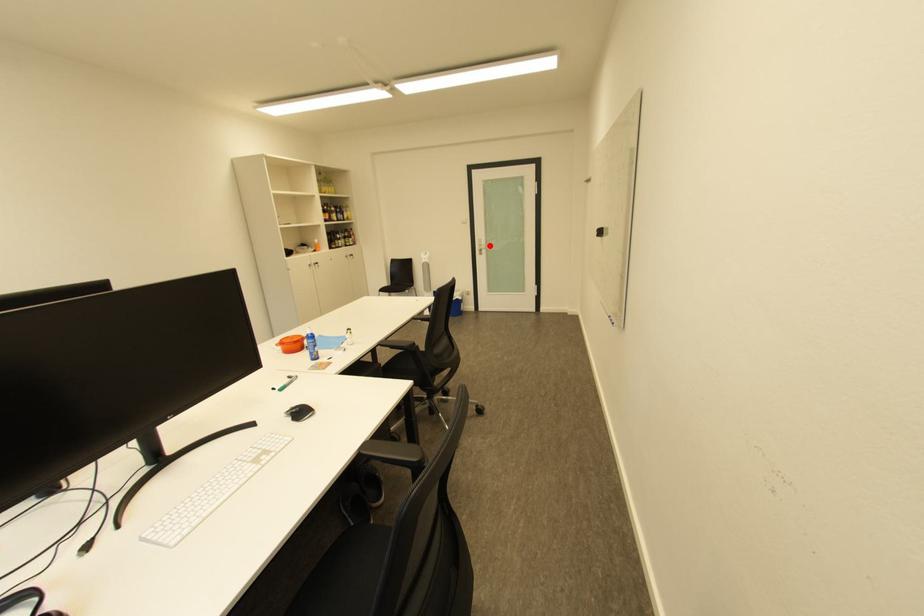
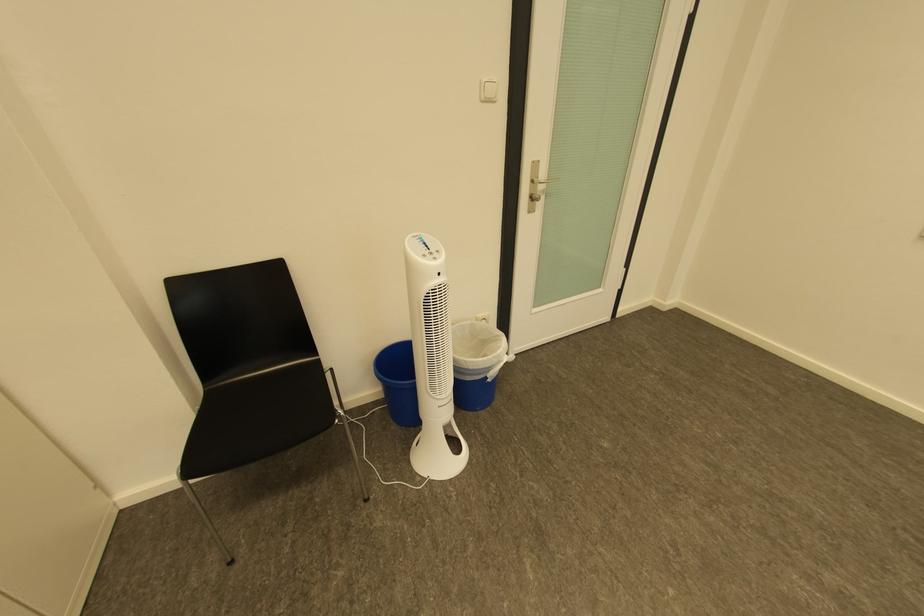
Where in the second image is the point corresponding to the highlighted location from the first image?

(541, 182)